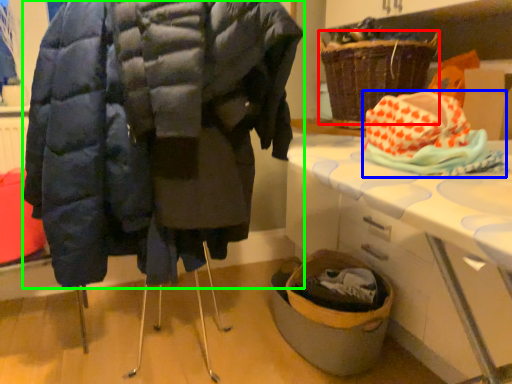
Question: Considering the real-world distances, which object is farthest from basket (highlighted by a red box)? material (highlighted by a blue box) or coat (highlighted by a green box)?

Choices:
 (A) material
 (B) coat

Answer: (A)